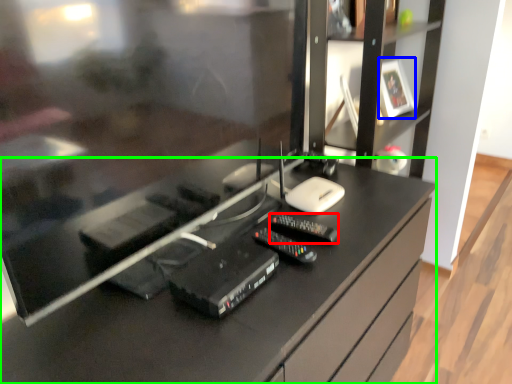
Question: Based on their relative distances, which object is nearer to control (highlighted by a red box)? Choose from picture frame (highlighted by a blue box) and desk (highlighted by a green box).

Choices:
 (A) picture frame
 (B) desk

Answer: (B)